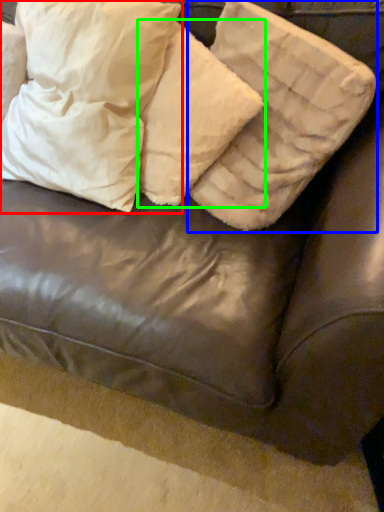
Question: Which is nearer to the pillow (highlighted by a red box)? pillow (highlighted by a blue box) or pillow (highlighted by a green box).

Choices:
 (A) pillow
 (B) pillow

Answer: (B)